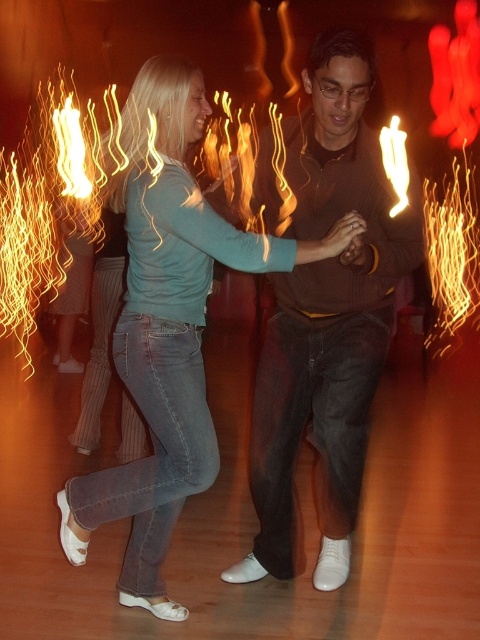
You are a photographer trying to capture a photo of the dark brown sweater at center and the matte teal shirt at center. The camera can only focus on one object at a time. Which object should you focus on first if you want to ensure both are in focus without moving the camera?

The dark brown sweater at center is located above the matte teal shirt at center. Since the camera can only focus on one object at a time, you should focus on the matte teal shirt at center first because it is closer to the camera, allowing the sweater above it to fall into the depth of field range when focusing on the lower object.

You are a photographer trying to capture a clear shot of both the dark brown sweater at center and the matte teal shirt at center. Since you can only focus on one object at a time, which one should you choose to ensure the other is still somewhat in focus?

You should focus on the dark brown sweater at center because it is in front of the matte teal shirt at center. By focusing on the closer object, the background object will still be somewhat in focus, allowing both to be visible though the sweater will be sharper.

You are a photographer trying to capture a closeup of the dark brown sweater at center and the matte teal shirt at center. Since you can only focus on one at a time, which one should you choose to ensure the other is still somewhat in focus?

The dark brown sweater at center is thinner than the matte teal shirt at center, so focusing on the matte teal shirt at center would allow the thinner dark brown sweater at center to be more in focus due to its smaller size.